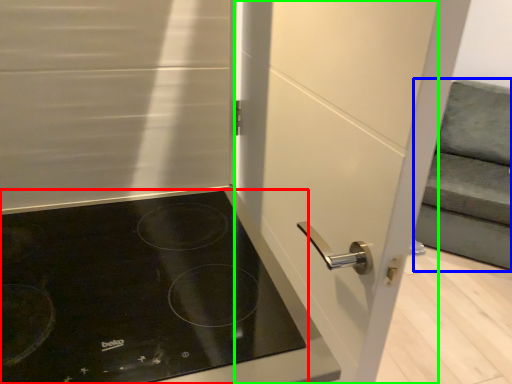
Question: Which object is positioned closest to gas stove (highlighted by a red box)? Select from armchair (highlighted by a blue box) and screen door (highlighted by a green box).

Choices:
 (A) armchair
 (B) screen door

Answer: (B)